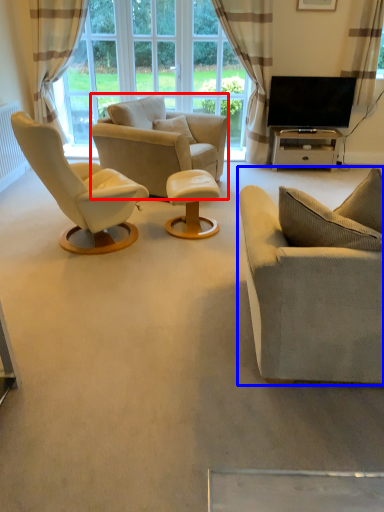
Question: Which of the following is the farthest to the observer, chair (highlighted by a red box) or studio couch (highlighted by a blue box)?

Choices:
 (A) chair
 (B) studio couch

Answer: (A)